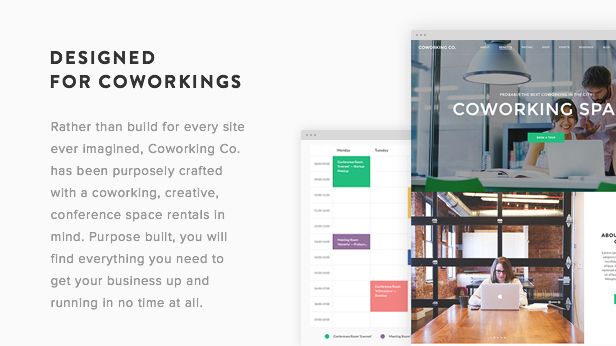
The image size is (616, 346). What are the coordinates of `brick walls` in the screenshot? It's located at (419, 286), (444, 282), (543, 248).